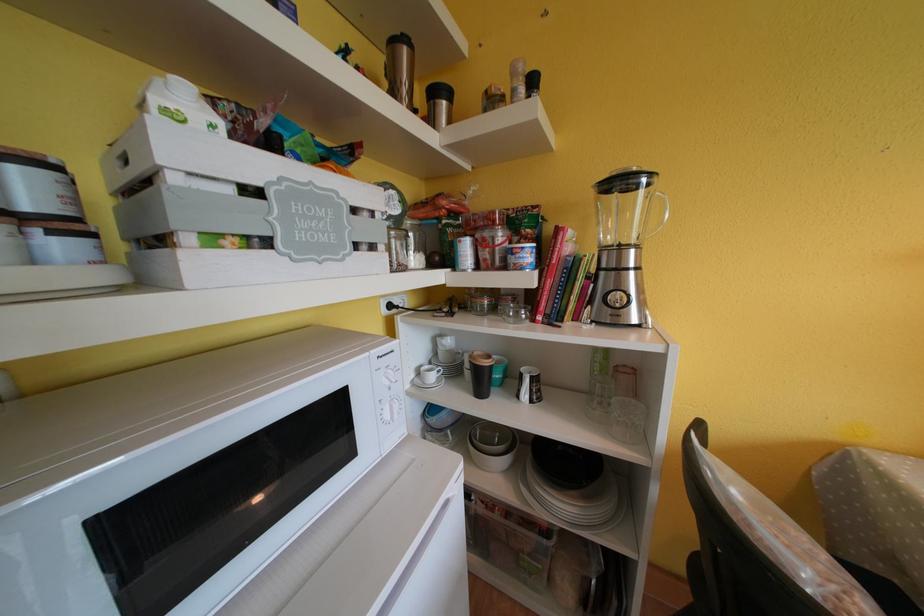
Identify the location of refrigerator door handle. This screenshot has width=924, height=616. (414, 560).